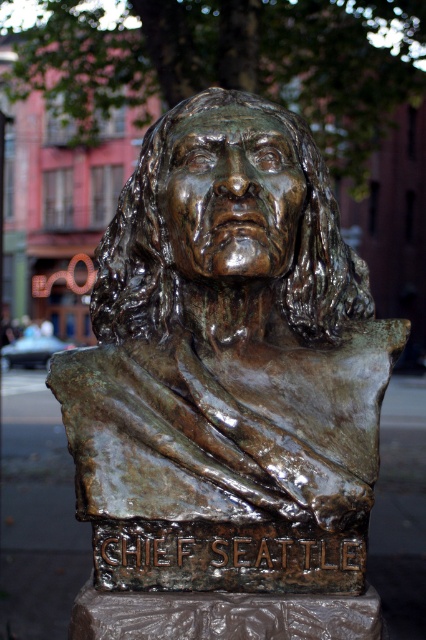
Locate an element on the screen. The width and height of the screenshot is (426, 640). bronze statue at center is located at coordinates (227, 365).

Which is behind, point (167, 436) or point (192, 138)?

Point (192, 138)

Image resolution: width=426 pixels, height=640 pixels. I want to click on bronze statue at center, so click(227, 365).